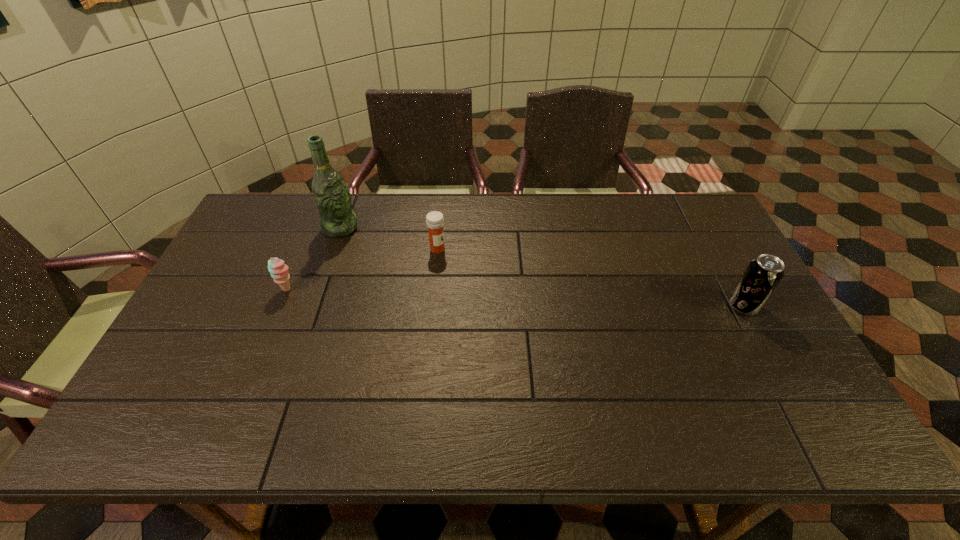
This screenshot has width=960, height=540. Find the location of `vacant space located on the label side of the third nearest object`. vacant space located on the label side of the third nearest object is located at coordinates (519, 292).

This screenshot has height=540, width=960. What are the coordinates of `vacant space located 0.230m on the label side of the third nearest object` in the screenshot? It's located at (505, 284).

Image resolution: width=960 pixels, height=540 pixels. Find the location of `vacant space situated on the surface of the farthest object`. vacant space situated on the surface of the farthest object is located at coordinates (380, 251).

Identify the location of free spot located 0.100m on the surface of the farthest object. (373, 247).

Identify the location of free point located 0.320m on the surface of the farthest object. Image resolution: width=960 pixels, height=540 pixels. (424, 278).

The image size is (960, 540). I want to click on object present at the far edge, so click(x=331, y=195).

Where is `object located at the right edge`? This screenshot has height=540, width=960. object located at the right edge is located at coordinates (763, 274).

Locate an element on the screen. This screenshot has height=540, width=960. vacant space at the far edge of the desktop is located at coordinates (444, 227).

At what (x,y) coordinates should I click in order to perform the action: click on free space at the near edge of the desktop. Please return your answer as a coordinate pair (x, y). The image size is (960, 540). Looking at the image, I should click on (224, 376).

What are the coordinates of `vacant area at the left edge` in the screenshot? It's located at (204, 339).